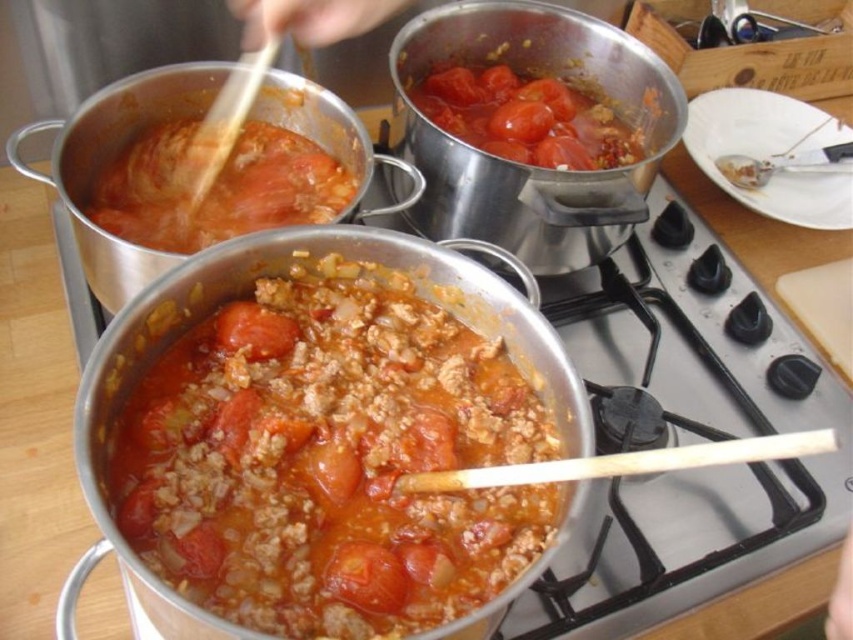
You are standing in front of the stove and see two points marked on the floor. The first point is at position point (834, 387) and the second point is at position point (132, 163). If you want to walk from the first point to the second point, will you need to step over any objects on the stove?

Since point (834, 387) is behind point (132, 163), you would have to step over the pots on the stove to move from the first point to the second point.